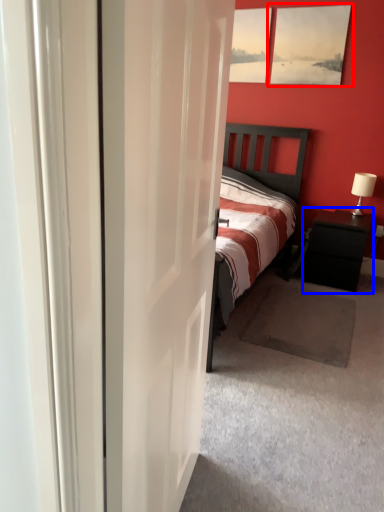
Question: Which point is closer to the camera, picture frame (highlighted by a red box) or nightstand (highlighted by a blue box)?

Choices:
 (A) picture frame
 (B) nightstand

Answer: (B)